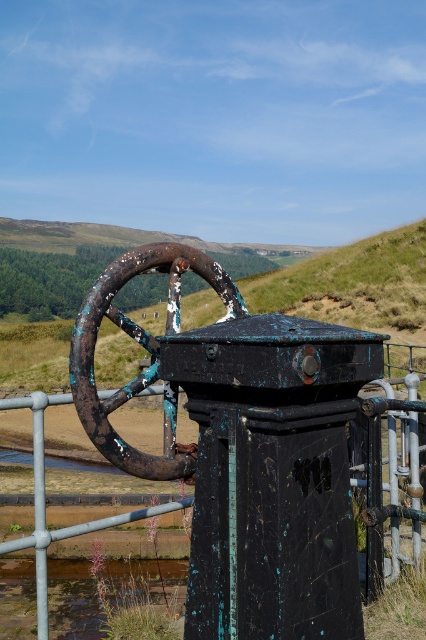
Can you confirm if rusty metal wheel at center is positioned below rusty metal fence at center?

Actually, rusty metal wheel at center is above rusty metal fence at center.

Which is behind, point (141, 384) or point (391, 410)?

Positioned behind is point (391, 410).

Where is `rusty metal wheel at center`? This screenshot has width=426, height=640. rusty metal wheel at center is located at coordinates (144, 348).